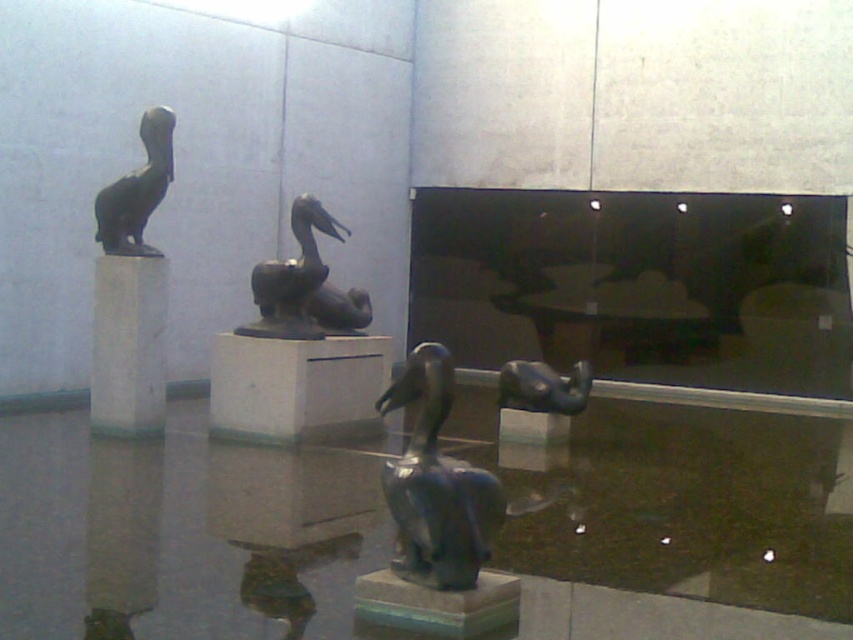
You are an art curator standing at the entrance of the gallery. You need to place a new sculpture that is 3 feet wide on the white marble pedestal at center. Can the pedestal accommodate the sculpture based on its dimensions?

The white marble pedestal at center is 28.00 feet away from the camera, but the question is about the pedestal accommodating a 3 feet wide sculpture. Since the pedestal is square and the description only provides distance, not size, we cannot determine if it fits. More information about the pedestal dimensions is needed.

You are standing in the art gallery and see two points marked in the image. The first point is at coordinate (294, 376) and the second is at (148, 324). Which point is closer to you?

Point (294, 376) is further to the viewer than point (148, 324), so the second point at (148, 324) is closer to you.

You are an art curator planning to place a new sculpture on the white marble pedestal at center. The sculpture requires a base that is wider than the white marble pillar at left to ensure stability. Can the pedestal accommodate this requirement?

The white marble pedestal at center might be wider than the white marble pillar at left, so there is a possibility that it can accommodate the sculpture requiring a wider base.